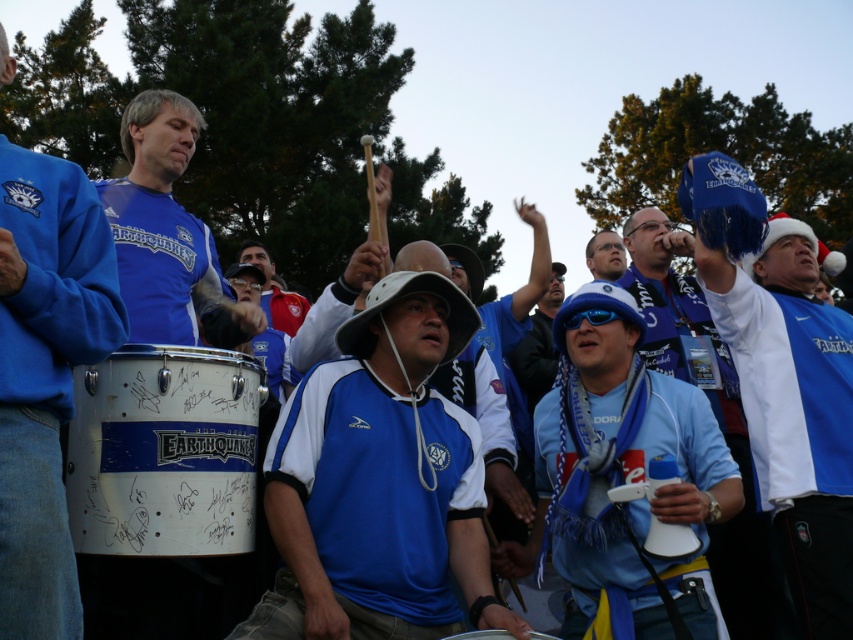
Question: Which of the following is the farthest from the observer?

Choices:
 (A) [x=225, y=356]
 (B) [x=291, y=323]

Answer: (B)

Question: Which of these objects is positioned farthest from the matte blue jersey at center?

Choices:
 (A) matte blue shirt at center
 (B) blue fabric scarf at center
 (C) blue fabric shirt at center

Answer: (A)

Question: Is matte blue sweatshirt at left below white metallic drum at center?

Choices:
 (A) no
 (B) yes

Answer: (A)

Question: From the image, what is the correct spatial relationship of white metallic drum at center in relation to white leather drum at center?

Choices:
 (A) above
 (B) below

Answer: (A)

Question: Is blue fabric scarf at center closer to the viewer compared to blue fabric hat at upper right?

Choices:
 (A) yes
 (B) no

Answer: (A)

Question: Estimate the real-world distances between objects in this image. Which object is closer to the blue fabric hat at upper right?

Choices:
 (A) matte blue jersey at center
 (B) matte blue shirt at center
 (C) blue jersey at center

Answer: (B)